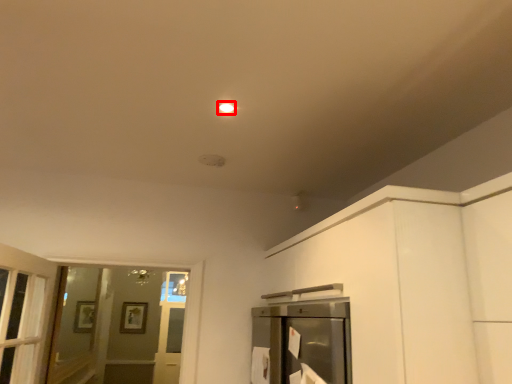
Question: Where is lighting (annotated by the red box) located in relation to screen door in the image?

Choices:
 (A) left
 (B) right

Answer: (B)